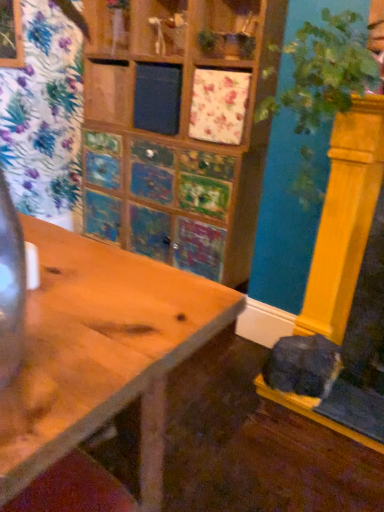
Question: Considering the positions of green leafy plant at right and wooden table at center in the image, is green leafy plant at right taller or shorter than wooden table at center?

Choices:
 (A) tall
 (B) short

Answer: (A)

Question: From the image's perspective, relative to wooden table at center, is green leafy plant at right above or below?

Choices:
 (A) below
 (B) above

Answer: (B)

Question: Considering the real-world distances, which object is closest to the wooden table at center?

Choices:
 (A) green leafy plant at right
 (B) soft gray fur cat at lower right

Answer: (A)

Question: Which of these objects is positioned farthest from the wooden table at center?

Choices:
 (A) soft gray fur cat at lower right
 (B) green leafy plant at right

Answer: (A)